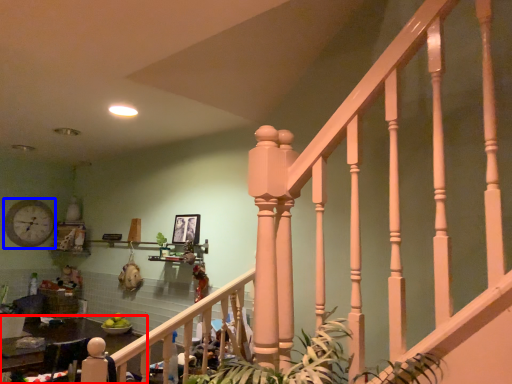
Question: Which object is closer to the camera taking this photo, table (highlighted by a red box) or clock (highlighted by a blue box)?

Choices:
 (A) table
 (B) clock

Answer: (A)